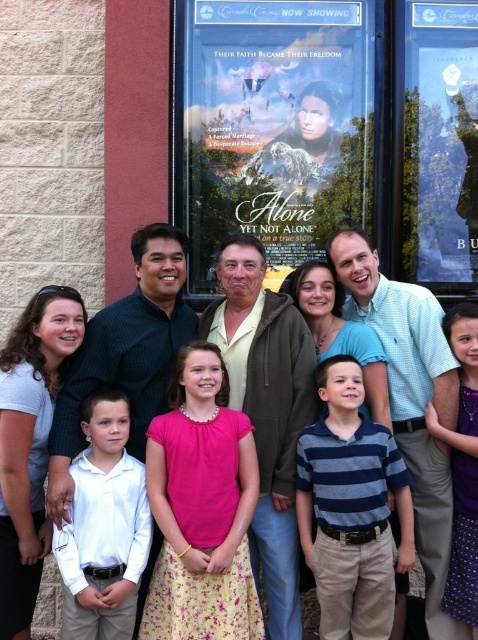
Based on the photo, which is below, matte yellow shirt at center or white cotton shirt at center?

white cotton shirt at center is below.

Who is positioned more to the left, matte yellow shirt at center or white cotton shirt at center?

From the viewer's perspective, white cotton shirt at center appears more on the left side.

In order to click on matte yellow shirt at center in this screenshot , I will do `click(267, 410)`.

Is point (228, 77) positioned before point (329, 476)?

No.

Is matte plastic movie poster at upper center taller than blue striped polo shirt at center?

Yes, matte plastic movie poster at upper center is taller than blue striped polo shirt at center.

Locate an element on the screen. The width and height of the screenshot is (478, 640). matte plastic movie poster at upper center is located at coordinates (275, 125).

At what (x,y) coordinates should I click in order to perform the action: click on blue striped polo shirt at center. Please return your answer as a coordinate pair (x, y). Looking at the image, I should click on (351, 509).

Is blue striped polo shirt at center further to the viewer compared to white cotton shirt at center?

That is True.

Locate an element on the screen. Image resolution: width=478 pixels, height=640 pixels. blue striped polo shirt at center is located at coordinates (351, 509).

Image resolution: width=478 pixels, height=640 pixels. Identify the location of blue striped polo shirt at center. (351, 509).